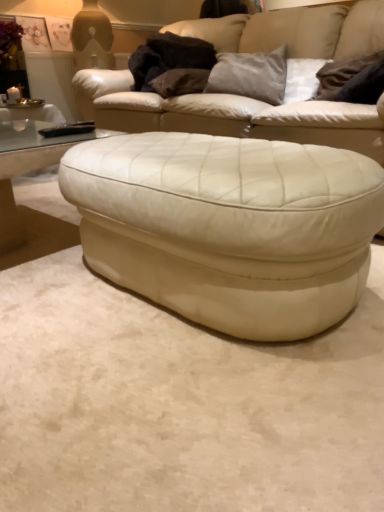
Identify the location of blank space situated above white leather ottoman at center (from a real-world perspective). (223, 152).